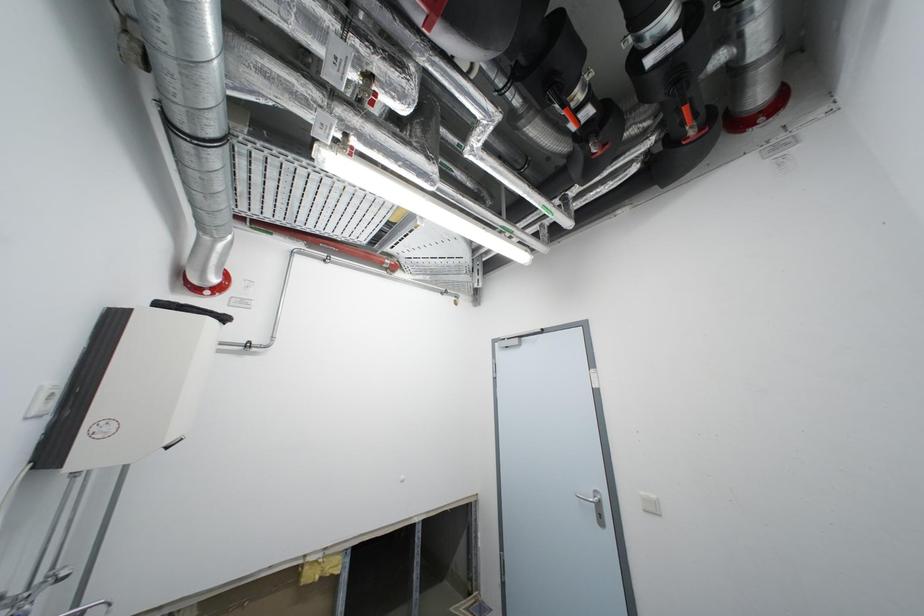
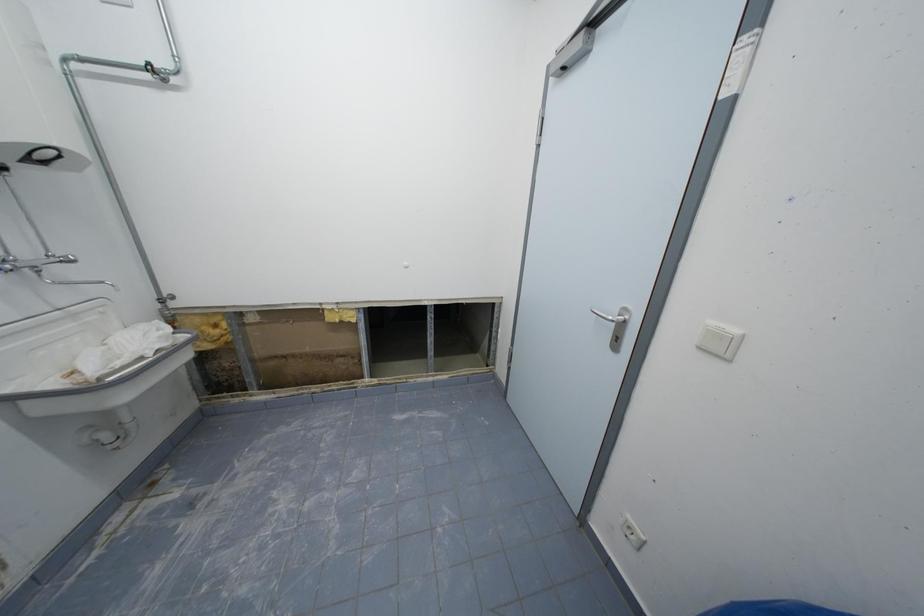
The images are taken continuously from a first-person perspective. In which direction is your viewpoint rotating?

The rotation direction of the camera is left-down.